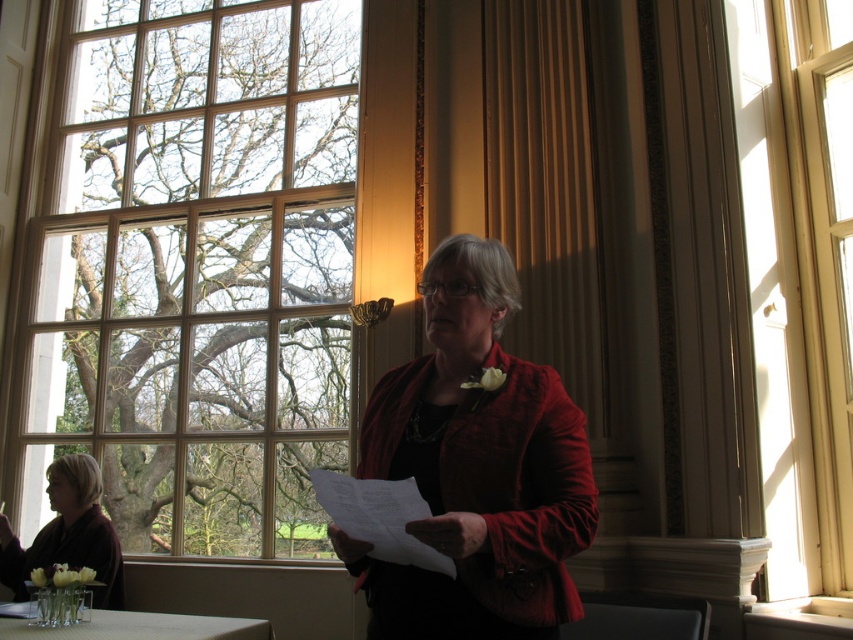
You are an interior designer assessing the natural light in the room. The clear glass window at upper left and wooden frame window at right are both sources of light. Which window allows more light into the room based on their heights?

The clear glass window at upper left has a lesser height compared to wooden frame window at right, so the wooden frame window at right allows more light into the room because it is taller.